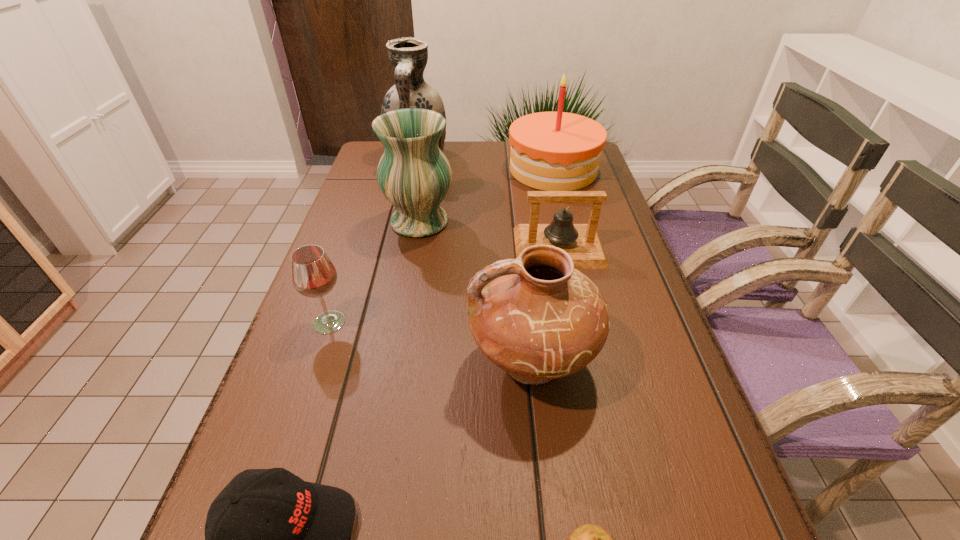
At what (x,y) coordinates should I click in order to perform the action: click on free spot located 0.320m on the side of the pottery with the handle. Please return your answer as a coordinate pair (x, y). Looking at the image, I should click on (299, 362).

At what (x,y) coordinates should I click in order to perform the action: click on free space located on the side of the pottery with the handle. Please return your answer as a coordinate pair (x, y). Looking at the image, I should click on (420, 362).

Where is `free point located on the side of the pottery with the handle`? This screenshot has width=960, height=540. free point located on the side of the pottery with the handle is located at coordinates (304, 362).

Locate an element on the screen. The image size is (960, 540). vacant space located on the right of the wineglass is located at coordinates (500, 322).

Identify the location of free space located on the back of the bell. The image size is (960, 540). (550, 205).

Identify the location of vase that is at the far edge. Image resolution: width=960 pixels, height=540 pixels. (408, 56).

You are a GUI agent. You are given a task and a screenshot of the screen. Output one action in this format:
    pyautogui.click(x=<x>, y=<y>)
    Task: Click on the birthday cake at the far edge
    The image size is (960, 540).
    Given the screenshot: What is the action you would take?
    pyautogui.click(x=551, y=151)

Where is `wineglass at the left edge`? Image resolution: width=960 pixels, height=540 pixels. wineglass at the left edge is located at coordinates (313, 275).

Find the location of `birthday cake that is positioned at the right edge`. birthday cake that is positioned at the right edge is located at coordinates (551, 151).

You are a GUI agent. You are given a task and a screenshot of the screen. Output one action in this format:
    pyautogui.click(x=<x>, y=<y>)
    Task: Click on the pottery positioned at the right edge
    The image size is (960, 540).
    Given the screenshot: What is the action you would take?
    pyautogui.click(x=538, y=318)